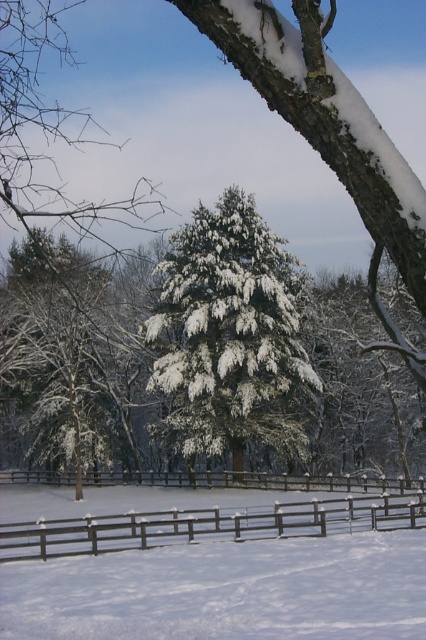
Question: Is brown wooden fence at lower center closer to camera compared to brown wooden fence at center?

Choices:
 (A) no
 (B) yes

Answer: (B)

Question: Can you confirm if white fluffy tree at center is thinner than brown wooden fence at center?

Choices:
 (A) no
 (B) yes

Answer: (B)

Question: Among these points, which one is nearest to the camera?

Choices:
 (A) (126, 515)
 (B) (57, 480)

Answer: (A)

Question: Can you confirm if white fluffy tree at center is bigger than brown wooden fence at center?

Choices:
 (A) no
 (B) yes

Answer: (B)

Question: Among these objects, which one is nearest to the camera?

Choices:
 (A) white fluffy tree at center
 (B) brown wooden fence at lower center

Answer: (B)

Question: Which point appears farthest from the camera in this image?

Choices:
 (A) (328, 500)
 (B) (310, 371)

Answer: (B)